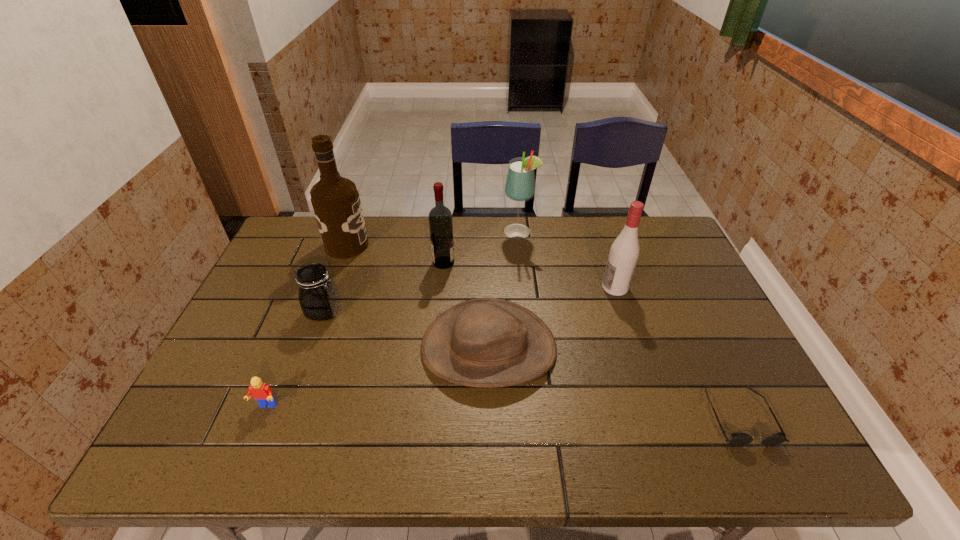
Where is `vacant space located 0.080m on the label of the leftmost alcohol`? The height and width of the screenshot is (540, 960). vacant space located 0.080m on the label of the leftmost alcohol is located at coordinates (392, 245).

Locate an element on the screen. vacant area located on the left of the third alcohol from left to right is located at coordinates (432, 232).

Find the location of a particular element. The width and height of the screenshot is (960, 540). vacant area situated on the label of the seventh object from left to right is located at coordinates (525, 288).

This screenshot has height=540, width=960. I want to click on vacant space located on the label of the seventh object from left to right, so click(x=525, y=288).

Locate an element on the screen. The width and height of the screenshot is (960, 540). vacant region located 0.250m on the label of the seventh object from left to right is located at coordinates (518, 288).

Image resolution: width=960 pixels, height=540 pixels. Identify the location of vacant space situated on the front and back of the second alcohol from left to right. (517, 262).

Locate an element on the screen. The image size is (960, 540). vacant space positioned on the lid of the jar is located at coordinates (449, 312).

Identify the location of vacant position located 0.370m on the right of the cowboy hat. The image size is (960, 540). tap(698, 348).

I want to click on vacant space located 0.090m on the front-facing side of the Lego, so click(248, 450).

Where is `object present at the near edge`? The width and height of the screenshot is (960, 540). object present at the near edge is located at coordinates (738, 439).